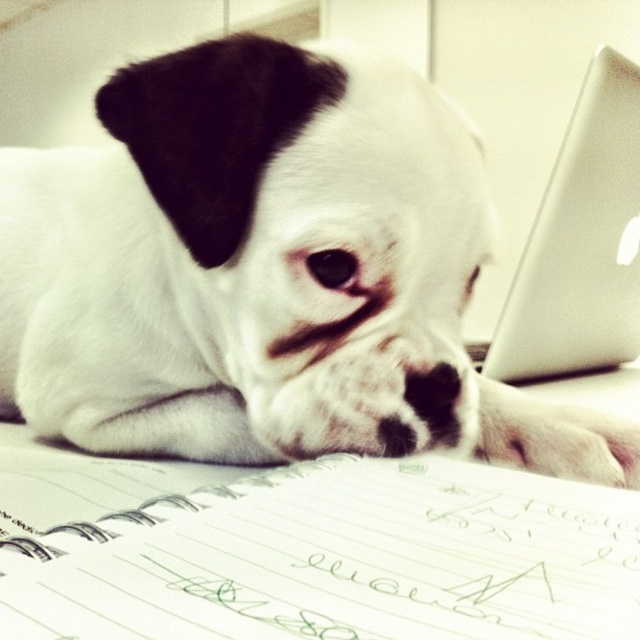
Question: Among these points, which one is nearest to the camera?

Choices:
 (A) (595, 352)
 (B) (620, 456)

Answer: (B)

Question: Which object is closer to the camera taking this photo?

Choices:
 (A) white matte dog at center
 (B) silver metallic laptop at upper right

Answer: (A)

Question: Is white matte dog at center smaller than silver metallic laptop at upper right?

Choices:
 (A) yes
 (B) no

Answer: (B)

Question: Does white matte dog at center have a greater width compared to silver metallic laptop at upper right?

Choices:
 (A) yes
 (B) no

Answer: (A)

Question: Among these points, which one is nearest to the camera?

Choices:
 (A) (289, 406)
 (B) (516, 355)

Answer: (A)

Question: Considering the relative positions of white matte dog at center and silver metallic laptop at upper right in the image provided, where is white matte dog at center located with respect to silver metallic laptop at upper right?

Choices:
 (A) left
 (B) right

Answer: (A)